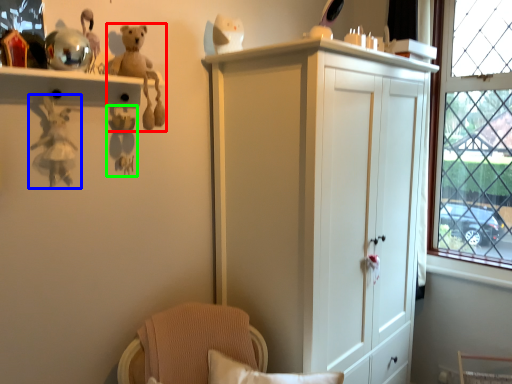
Question: Estimate the real-world distances between objects in this image. Which object is farther from toy (highlighted by a red box), toy (highlighted by a blue box) or toy (highlighted by a green box)?

Choices:
 (A) toy
 (B) toy

Answer: (A)